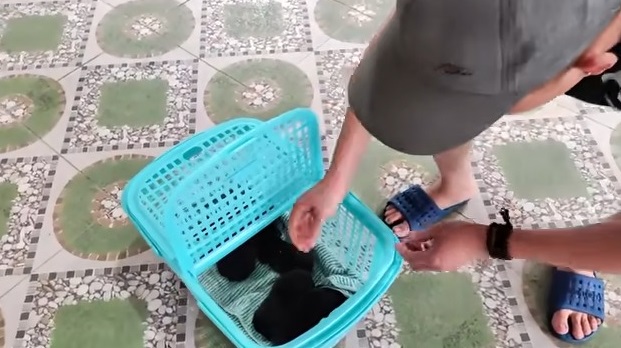
Locate an element on the screen. The image size is (621, 348). basket lid is located at coordinates (161, 178), (193, 203).